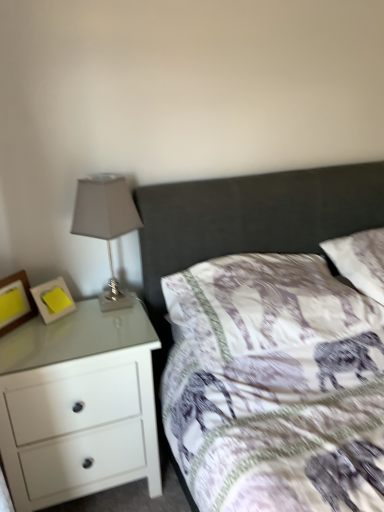
Locate an element on the screen. The height and width of the screenshot is (512, 384). vacant area that lies to the right of wooden picture frame at left, marked as the first picture frame in a left-to-right arrangement is located at coordinates (52, 329).